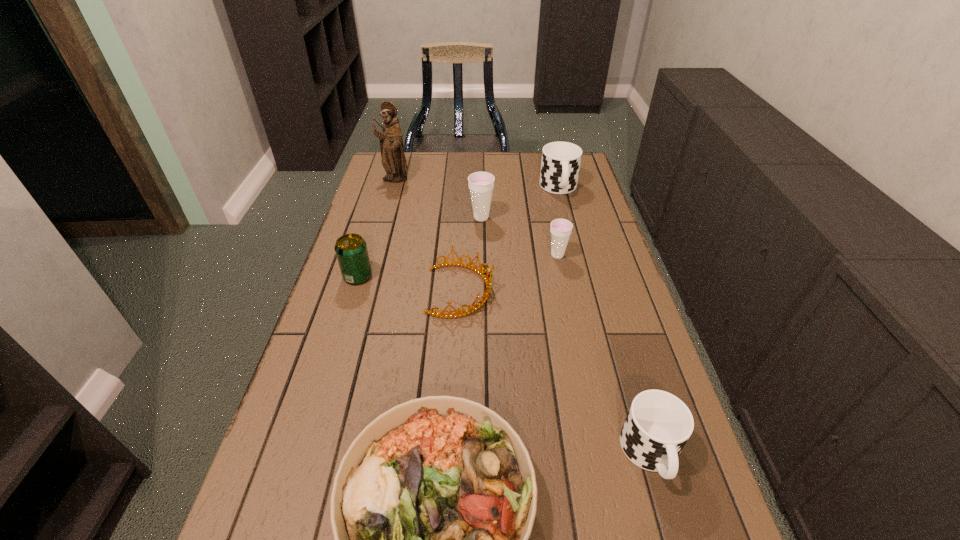
Point out which object is positioned as the fourth nearest to the fourth farthest object. Please provide its 2D coordinates. Your answer should be formatted as a tuple, i.e. [(x, y)], where the tuple contains the x and y coordinates of a point satisfying the conditions above.

[(351, 250)]

In order to click on cup that is the closest to the nearest cup in this screenshot , I will do `click(561, 229)`.

Identify the location of cup that is the second nearest to the green beer can. This screenshot has height=540, width=960. (561, 229).

Locate an element on the screen. The image size is (960, 540). the closest black cup to the salad plate is located at coordinates (658, 425).

Find the location of `black cup that can be found as the second closest to the beer can`. black cup that can be found as the second closest to the beer can is located at coordinates (658, 425).

This screenshot has height=540, width=960. I want to click on vacant space that satisfies the following two spatial constraints: 1. on the front-facing side of the third farthest object; 2. on the left side of the figurine, so click(x=384, y=218).